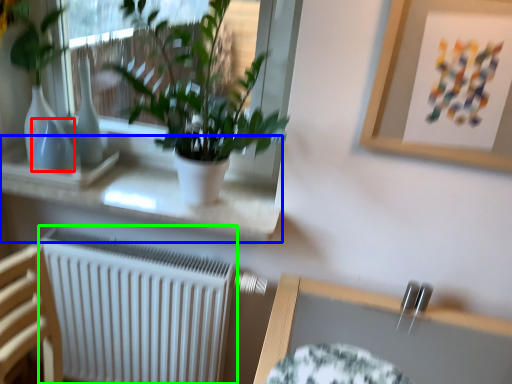
Question: Considering the real-world distances, which object is closest to vase (highlighted by a red box)? window sill (highlighted by a blue box) or radiator (highlighted by a green box).

Choices:
 (A) window sill
 (B) radiator

Answer: (A)